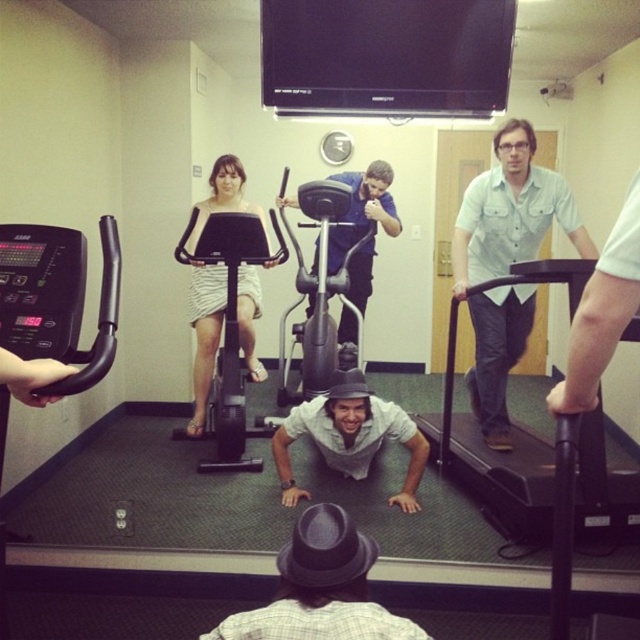
Question: Which of the following is the closest to the observer?

Choices:
 (A) gray cotton shirt at center
 (B) light blue shirt at center

Answer: (B)

Question: Is black rubber treadmill at right positioned in front of light blue shirt at center?

Choices:
 (A) no
 (B) yes

Answer: (B)

Question: Which point appears farthest from the camera in this image?

Choices:
 (A) (536, 496)
 (B) (492, 168)
 (C) (337, 330)

Answer: (C)

Question: Which point is closer to the camera?

Choices:
 (A) gray felt fedora at center
 (B) gray cotton shirt at center
 (C) black rubber treadmill at right
 (D) blue fabric shirt at center

Answer: (A)

Question: Does black rubber treadmill at right appear on the left side of gray felt fedora at center?

Choices:
 (A) no
 (B) yes

Answer: (A)

Question: Does light blue shirt at center appear under gray cotton shirt at center?

Choices:
 (A) yes
 (B) no

Answer: (B)